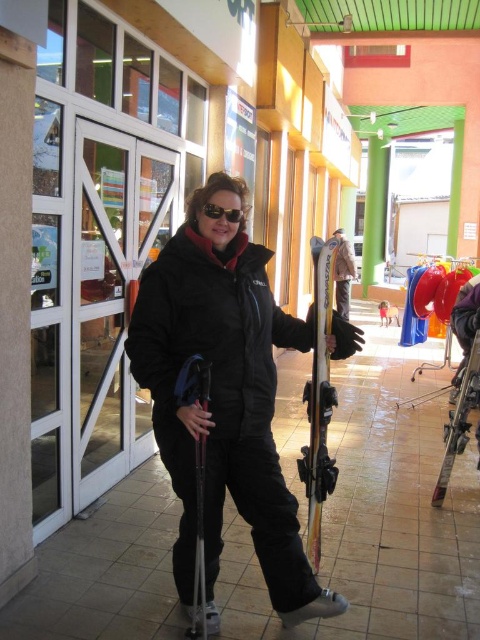
You are a delivery person who needs to place a package on the ground near the shiny metallic skis at center. Based on their position, where should you place the package relative to the skis?

The shiny metallic skis at center are located at point coordinates of (319, 400). Therefore, you should place the package near those coordinates to ensure it is close to the skis.

You are a tailor measuring the distance between the black matte jacket at center and the black reflective sunglasses at center for a custom fitting. The minimum required distance for proper fitting is 25 inches. Can the current distance accommodate the fitting requirements?

The black matte jacket at center is 28.19 inches from the black reflective sunglasses at center, which exceeds the minimum required distance of 25 inches. Therefore, the current distance can accommodate the fitting requirements.